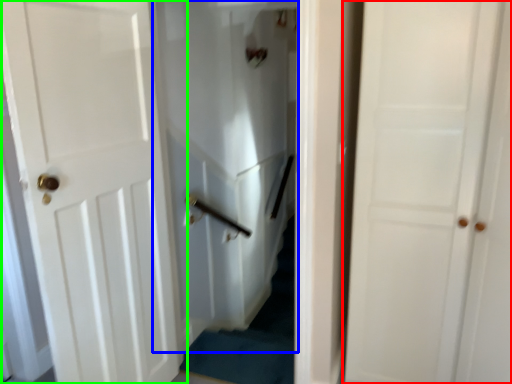
Question: Which is farther away from door (highlighted by a red box)? elevator (highlighted by a blue box) or door (highlighted by a green box)?

Choices:
 (A) elevator
 (B) door

Answer: (A)